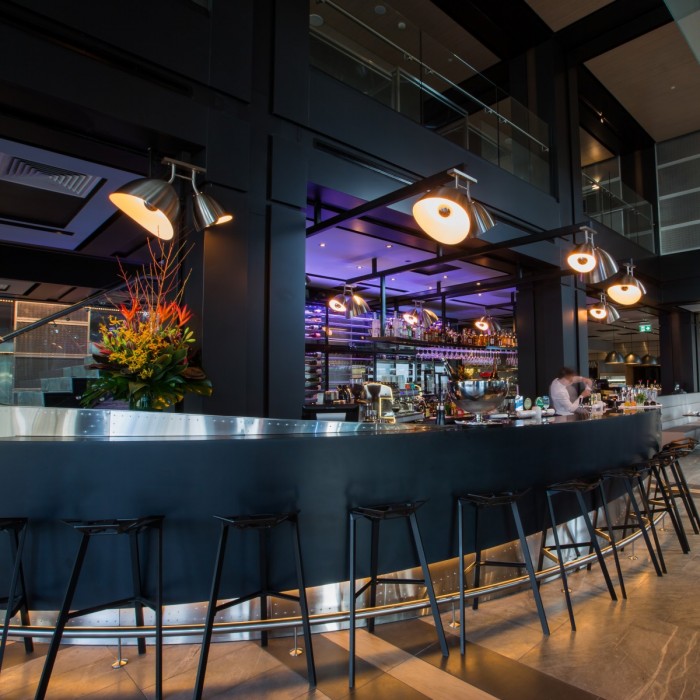
Where is `ceiling`? The width and height of the screenshot is (700, 700). ceiling is located at coordinates (643, 50).